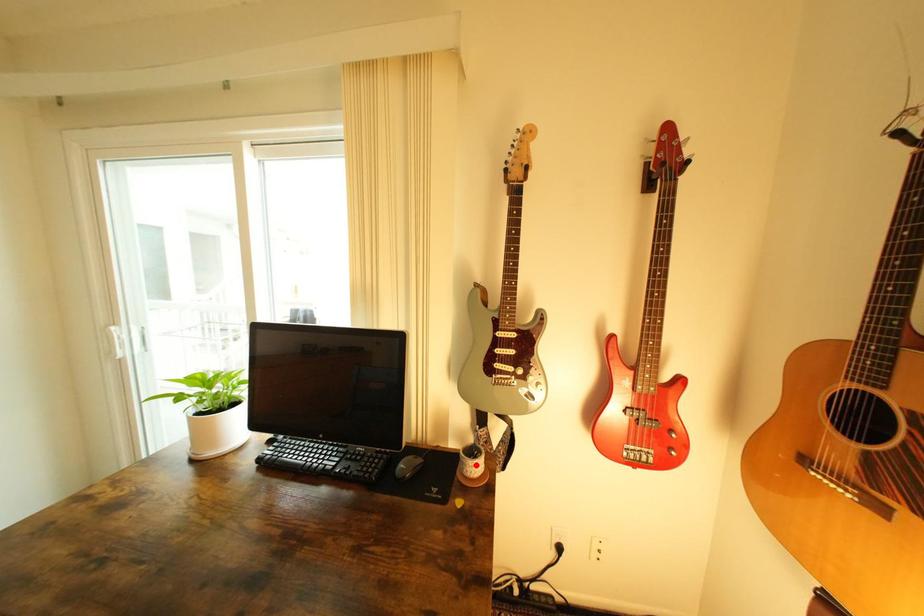
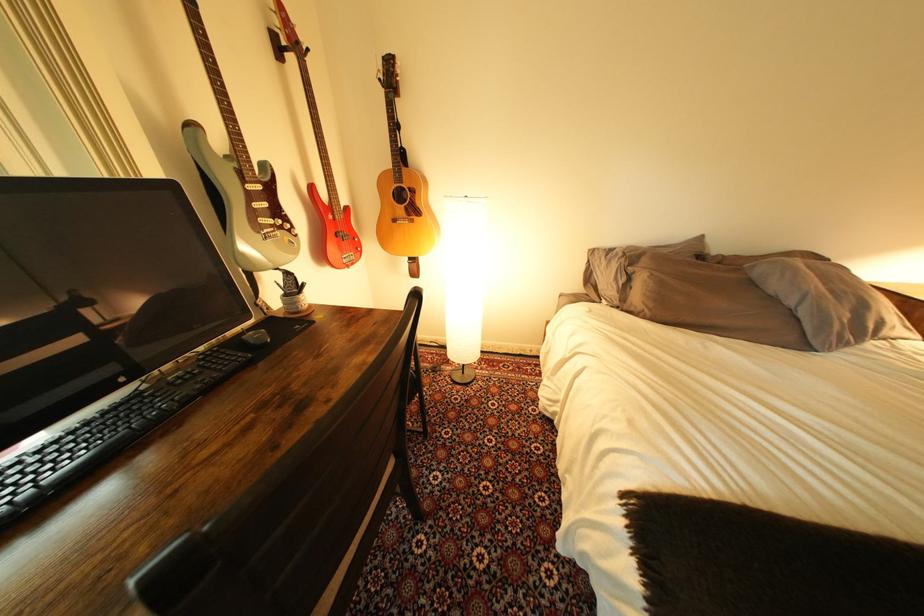
Where in the second image is the point corresponding to the highlighted location from the first image?

(309, 304)